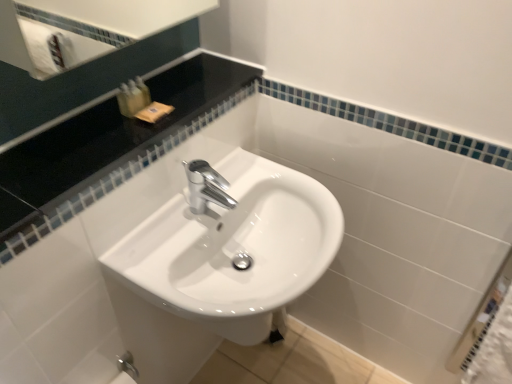
Locate an element on the screen. The width and height of the screenshot is (512, 384). vacant space behind polished chrome tap at center is located at coordinates (236, 173).